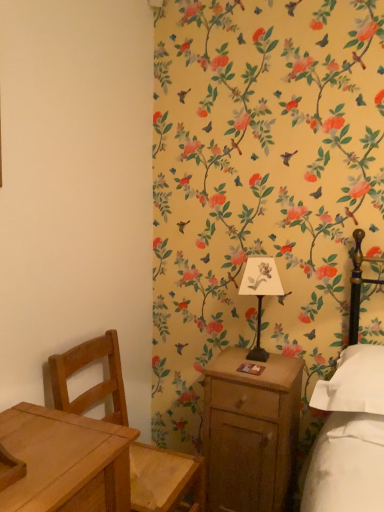
This screenshot has width=384, height=512. In order to click on free spot in front of metallic black bedside lamp at center-right in this screenshot , I will do `click(261, 378)`.